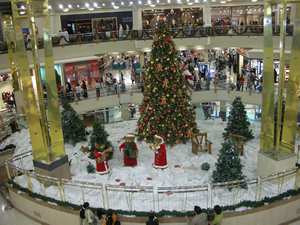
This screenshot has width=300, height=225. Find the location of `chair`. chair is located at coordinates (201, 142), (239, 145).